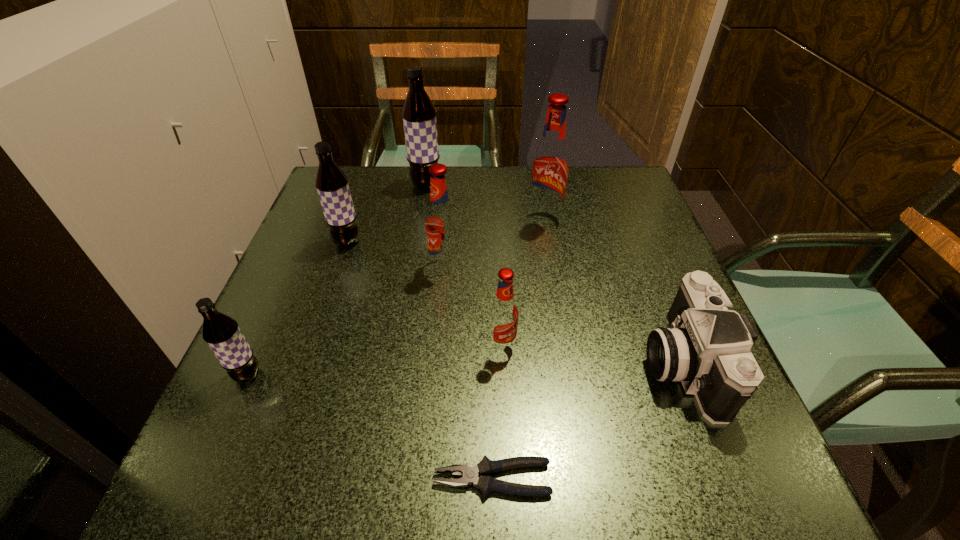
Where is `free spot that satisfies the following two spatial constraints: 1. on the back side of the nearest brown root beer; 2. on the left side of the rightmost root beer`? Image resolution: width=960 pixels, height=540 pixels. free spot that satisfies the following two spatial constraints: 1. on the back side of the nearest brown root beer; 2. on the left side of the rightmost root beer is located at coordinates (317, 220).

Locate an element on the screen. This screenshot has width=960, height=540. vacant space that satisfies the following two spatial constraints: 1. on the front side of the leftmost red root beer; 2. on the left side of the second red root beer from right to left is located at coordinates (439, 345).

In order to click on vacant position in the image that satisfies the following two spatial constraints: 1. on the back side of the leftmost object; 2. on the left side of the second nearest red root beer in this screenshot , I will do `click(296, 266)`.